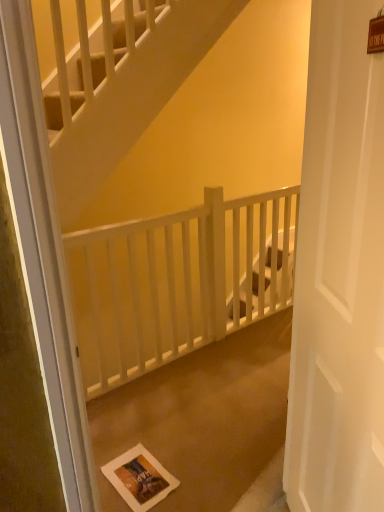
Identify the location of white paper bag at center. The image size is (384, 512). (202, 417).

Is white paper postcard at lower center touching white paper bag at center?

white paper postcard at lower center and white paper bag at center are not in contact.

From a real-world perspective, which object rests below the other?

white paper postcard at lower center is physically lower.

How much distance is there between white paper postcard at lower center and white paper bag at center?

white paper postcard at lower center is 14.65 inches away from white paper bag at center.

From the image's perspective, which is above, white paper postcard at lower center or white paper bag at center?

white paper bag at center appears higher in the image.

From the picture: Which of these two, white matte door at center or white paper bag at center, stands shorter?

white paper bag at center is shorter.

From the image's perspective, is white matte door at center beneath white paper bag at center?

Actually, white matte door at center appears above white paper bag at center in the image.

Looking at their sizes, would you say white matte door at center is wider or thinner than white paper bag at center?

Considering their sizes, white matte door at center looks slimmer than white paper bag at center.

Is white paper bag at center a part of white matte door at center?

No, white matte door at center does not contain white paper bag at center.

Are white paper bag at center and white paper postcard at lower center beside each other?

No, white paper bag at center is not next to white paper postcard at lower center.

Consider the image. What's the angular difference between white paper bag at center and white paper postcard at lower center's facing directions?

3.62 degrees separate the facing orientations of white paper bag at center and white paper postcard at lower center.

Does white paper bag at center have a lesser width compared to white paper postcard at lower center?

No.

Which object is closer to the camera taking this photo, white paper bag at center or white paper postcard at lower center?

white paper bag at center is in front.

Is white wooden balustrade at center behind white paper postcard at lower center?

Yes, white wooden balustrade at center is further from the viewer.

Is white wooden balustrade at center positioned far away from white paper postcard at lower center?

white wooden balustrade at center is near white paper postcard at lower center, not far away.

Is white wooden balustrade at center inside or outside of white paper postcard at lower center?

white wooden balustrade at center is located beyond the bounds of white paper postcard at lower center.

From the image's perspective, would you say white wooden balustrade at center is positioned over white paper postcard at lower center?

Indeed, from the image's perspective, white wooden balustrade at center is shown above white paper postcard at lower center.

From the picture: From a real-world perspective, who is located higher, white matte door at center or white wooden balustrade at center?

white matte door at center, from a real-world perspective.

Which is in front, point (301, 276) or point (205, 240)?

The point (301, 276) is closer.

Is white matte door at center oriented away from white wooden balustrade at center?

white matte door at center does not have its back to white wooden balustrade at center.

From the image's perspective, is white matte door at center located beneath white wooden balustrade at center?

Yes, from the image's perspective, white matte door at center is beneath white wooden balustrade at center.

Considering the sizes of objects white paper bag at center and white matte door at center in the image provided, who is shorter, white paper bag at center or white matte door at center?

With less height is white paper bag at center.

Considering the relative positions of white paper bag at center and white matte door at center in the image provided, is white paper bag at center to the left of white matte door at center from the viewer's perspective?

Yes, white paper bag at center is to the left of white matte door at center.

From the image's perspective, between white paper bag at center and white matte door at center, which one is located above?

white matte door at center, from the image's perspective.

Based on the photo, is white paper bag at center not near white matte door at center?

white paper bag at center is far away from white matte door at center.

Which is nearer, (108,351) or (362,251)?

The point (362,251) is closer to the camera.

Does white wooden balustrade at center have a smaller size compared to white matte door at center?

Actually, white wooden balustrade at center might be larger than white matte door at center.

Is white wooden balustrade at center taller than white matte door at center?

No, white wooden balustrade at center is not taller than white matte door at center.

Find the location of a particular element. concrete above the white paper postcard at lower center (from a real-world perspective) is located at coordinates (202, 417).

This screenshot has width=384, height=512. What are the coordinates of `door that is above the white paper bag at center (from the image's perspective)` in the screenshot? It's located at (339, 273).

Considering their positions, is white matte door at center positioned further to white wooden balustrade at center than white paper bag at center?

white matte door at center is further to white wooden balustrade at center.

Considering their positions, is white wooden balustrade at center positioned further to white matte door at center than white paper bag at center?

white wooden balustrade at center is positioned further to the anchor white matte door at center.

Considering their positions, is white matte door at center positioned closer to white paper bag at center than white wooden balustrade at center?

white wooden balustrade at center is positioned closer to the anchor white paper bag at center.

Based on their spatial positions, is white paper postcard at lower center or white wooden balustrade at center further from white paper bag at center?

white wooden balustrade at center lies further to white paper bag at center than the other object.

From the image, which object appears to be farther from white paper bag at center, white paper postcard at lower center or white matte door at center?

Based on the image, white matte door at center appears to be further to white paper bag at center.

Looking at the image, which one is located further to white paper postcard at lower center, white matte door at center or white paper bag at center?

white matte door at center lies further to white paper postcard at lower center than the other object.

Looking at the image, which one is located closer to white paper postcard at lower center, white paper bag at center or white matte door at center?

white paper bag at center is closer to white paper postcard at lower center.

From the image, which object appears to be nearer to white paper postcard at lower center, white wooden balustrade at center or white matte door at center?

white wooden balustrade at center.

Where is `postcard between white matte door at center and white wooden balustrade at center along the z-axis`? Image resolution: width=384 pixels, height=512 pixels. postcard between white matte door at center and white wooden balustrade at center along the z-axis is located at coordinates (139, 478).

Find the location of a particular element. The height and width of the screenshot is (512, 384). concrete positioned between white matte door at center and white paper postcard at lower center from near to far is located at coordinates (202, 417).

Find the location of a particular element. The width and height of the screenshot is (384, 512). concrete positioned between white matte door at center and white wooden balustrade at center from near to far is located at coordinates [202, 417].

At what (x,y) coordinates should I click in order to perform the action: click on concrete between white wooden balustrade at center and white paper postcard at lower center in the up-down direction. Please return your answer as a coordinate pair (x, y). This screenshot has height=512, width=384. Looking at the image, I should click on (202, 417).